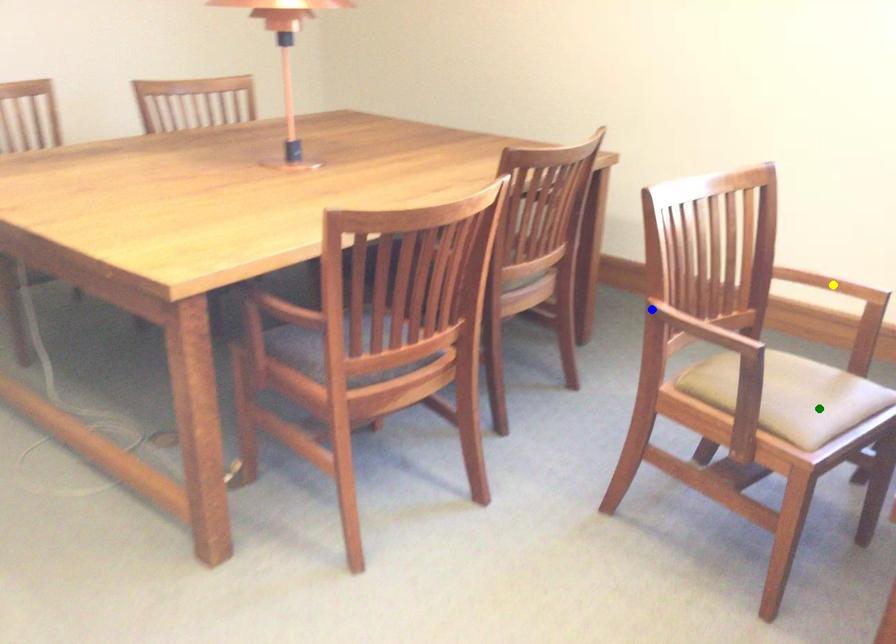
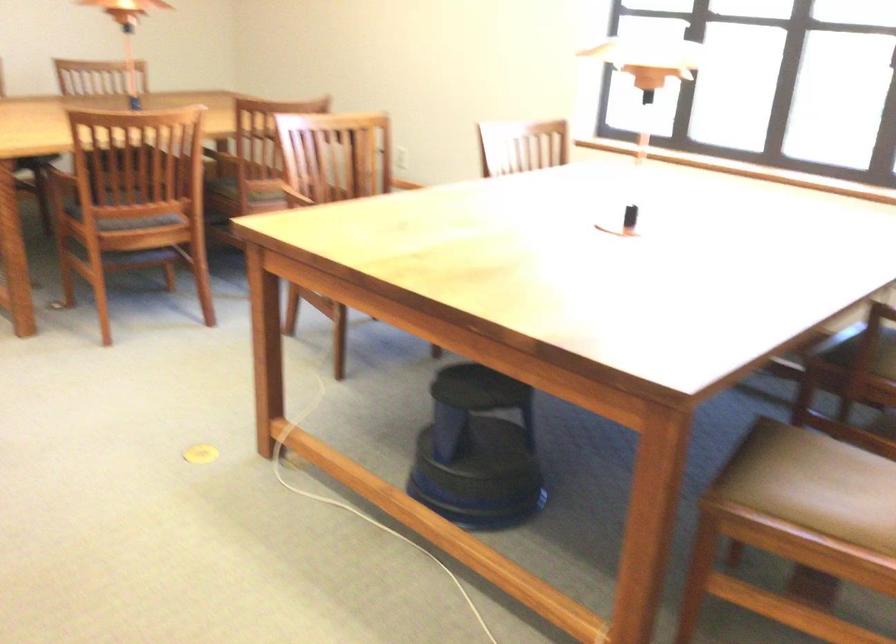
I am providing you with two images of the same scene from different viewpoints. Three points are marked in image1. Which point corresponds to a part or object that is occluded in image2?In image1, three points are marked. Which of them correspond to a part or object that is occluded in image2?Among the three points shown in image1, which one corresponds to a part or object that is no longer visible due to occlusion in image2?

Invisible in image2: green point, yellow point.